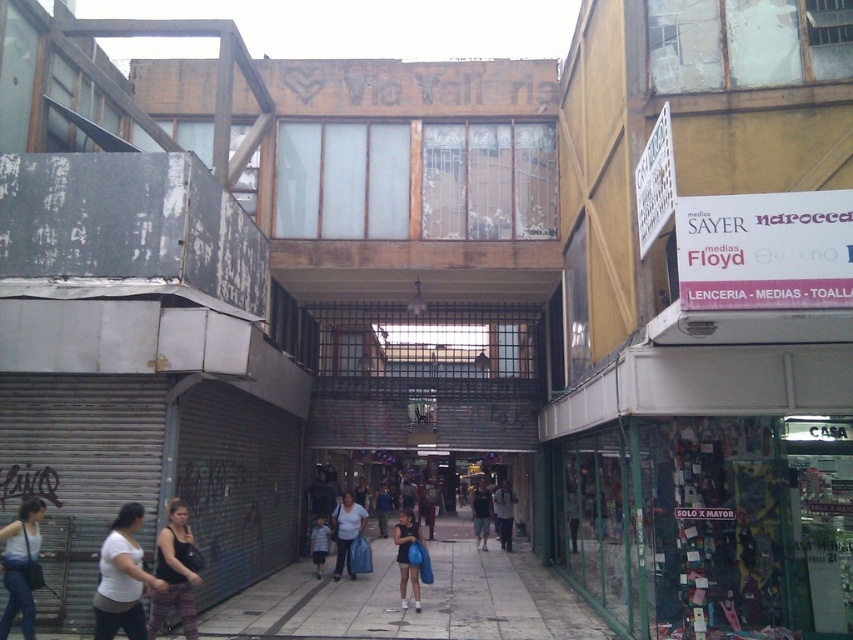
Question: Which point is farther to the camera?

Choices:
 (A) (404, 560)
 (B) (312, 563)
 (C) (163, 557)
 (D) (389, 493)

Answer: (D)

Question: Which of the following is the closest to the observer?

Choices:
 (A) white tank top at lower left
 (B) striped cotton shirt at center
 (C) light blue jeans at center
 (D) matte black tank top at lower left

Answer: (D)

Question: Which object is closer to the camera taking this photo?

Choices:
 (A) white matte shirt at lower left
 (B) matte blue bag at center

Answer: (A)

Question: Is matte blue bag at center thinner than white matte shirt at lower left?

Choices:
 (A) yes
 (B) no

Answer: (B)

Question: Is white matte shirt at lower left to the left of light blue jeans at center from the viewer's perspective?

Choices:
 (A) yes
 (B) no

Answer: (A)

Question: Can you confirm if white tank top at lower left is bigger than blue fabric bag at center?

Choices:
 (A) yes
 (B) no

Answer: (B)